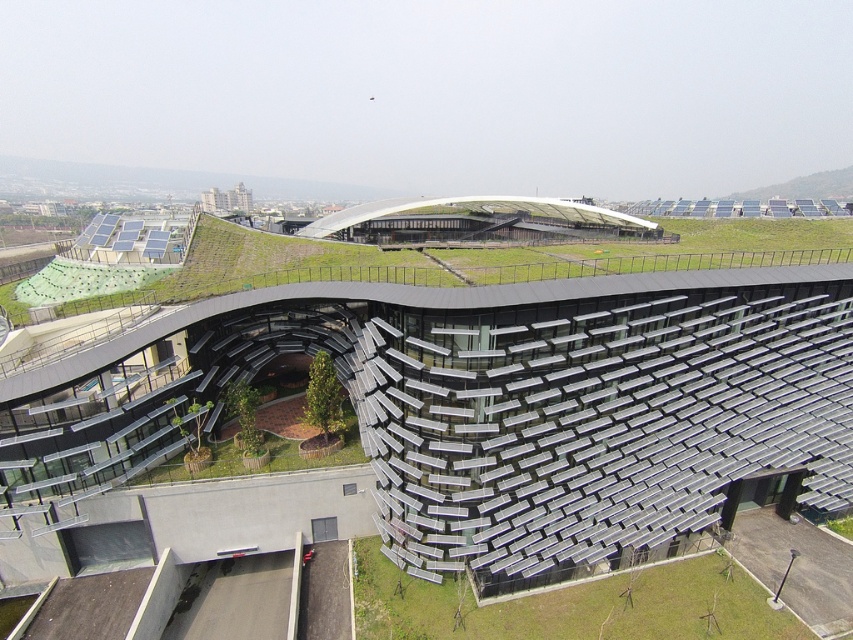
Does green grass at upper center appear under green grass at lower right?

Incorrect, green grass at upper center is not positioned below green grass at lower right.

Can you confirm if green grass at upper center is taller than green grass at lower right?

Yes, green grass at upper center is taller than green grass at lower right.

Who is more distant from viewer, (190, 291) or (663, 566)?

The point (190, 291) is more distant.

Find the location of a particular element. The height and width of the screenshot is (640, 853). green grass at upper center is located at coordinates (672, 250).

Between metallic solar panels at center and green grass at lower right, which one has more height?

Standing taller between the two is metallic solar panels at center.

Between metallic solar panels at center and green grass at lower right, which one has less height?

Standing shorter between the two is green grass at lower right.

Describe the element at coordinates (511, 404) in the screenshot. I see `metallic solar panels at center` at that location.

The width and height of the screenshot is (853, 640). I want to click on metallic solar panels at center, so click(x=511, y=404).

Which is in front, point (550, 300) or point (469, 264)?

Point (550, 300) is in front.

Does metallic solar panels at center appear on the right side of green grass at upper center?

No, metallic solar panels at center is not to the right of green grass at upper center.

I want to click on metallic solar panels at center, so click(x=511, y=404).

This screenshot has width=853, height=640. Find the location of `metallic solar panels at center`. metallic solar panels at center is located at coordinates coord(511,404).